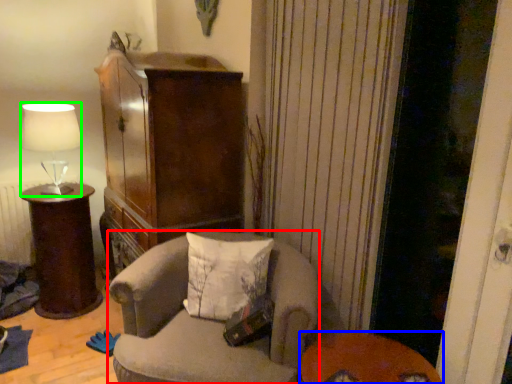
Question: Which is farther away from chair (highlighted by a red box)? table (highlighted by a blue box) or lamp (highlighted by a green box)?

Choices:
 (A) table
 (B) lamp

Answer: (B)